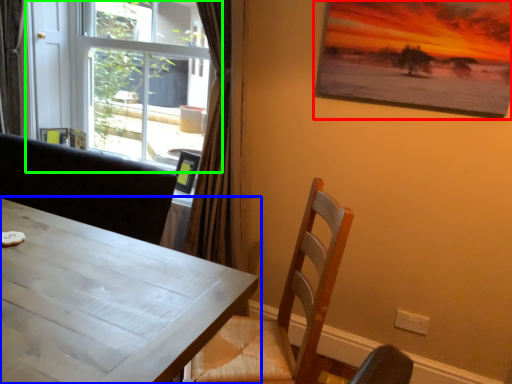
Question: Based on their relative distances, which object is nearer to picture frame (highlighted by a red box)? Choose from table (highlighted by a blue box) and window (highlighted by a green box).

Choices:
 (A) table
 (B) window

Answer: (A)